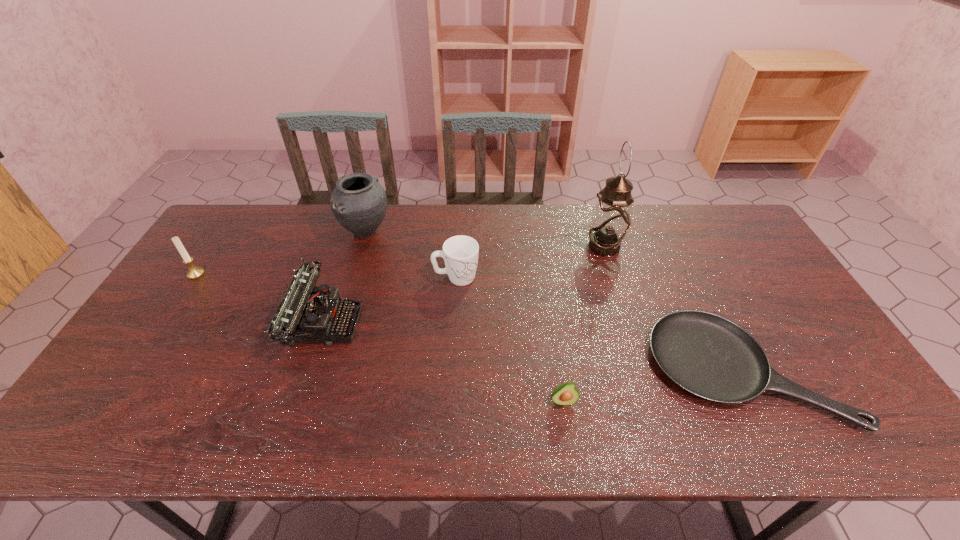
The width and height of the screenshot is (960, 540). Find the location of `oil lamp`. oil lamp is located at coordinates (611, 220).

Image resolution: width=960 pixels, height=540 pixels. Identify the location of urn. coord(359,203).

Locate an element on the screen. the third tallest object is located at coordinates (194, 272).

Locate an element on the screen. The width and height of the screenshot is (960, 540). the leftmost object is located at coordinates (194, 272).

The image size is (960, 540). I want to click on mug, so click(x=460, y=253).

At what (x,y) coordinates should I click in order to perform the action: click on typewriter. Please return your answer as a coordinate pair (x, y). The image size is (960, 540). Looking at the image, I should click on pos(306,313).

What are the coordinates of `the third object from right to left` in the screenshot? It's located at (565, 394).

Where is `avocado`? avocado is located at coordinates (565, 394).

Identify the location of the shortest object. (707, 355).

At what (x,y) coordinates should I click in order to perform the action: click on free region located on the front of the oil lamp. Please return your answer as a coordinate pair (x, y). The height and width of the screenshot is (540, 960). Looking at the image, I should click on (641, 364).